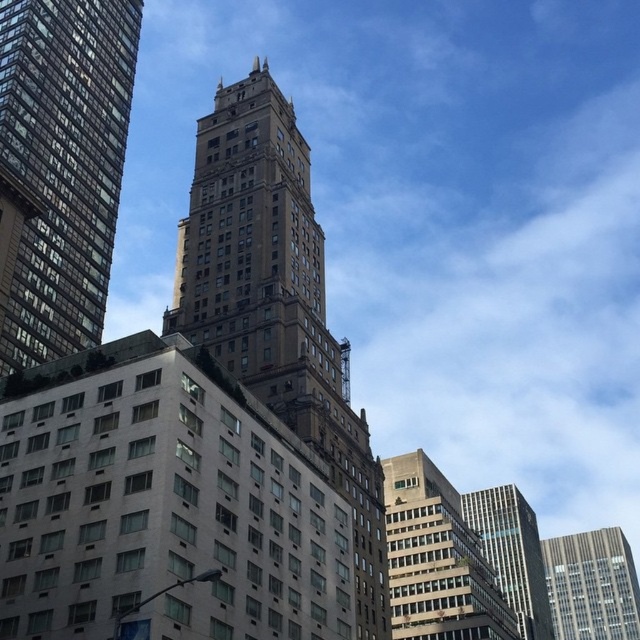
Question: Which object is farther from the camera taking this photo?

Choices:
 (A) glassy reflective skyscraper at center
 (B) gray concrete building at center
 (C) gray concrete skyscraper at center
 (D) brown stone tower at upper left

Answer: (C)

Question: Can you confirm if brown stone tower at center is smaller than glassy reflective skyscraper at center?

Choices:
 (A) yes
 (B) no

Answer: (A)

Question: Estimate the real-world distances between objects in this image. Which object is farther from the gray concrete building at center?

Choices:
 (A) brown stone tower at upper left
 (B) brown stone tower at center

Answer: (A)

Question: Is brown stone tower at center to the left of brown stone tower at upper left from the viewer's perspective?

Choices:
 (A) yes
 (B) no

Answer: (B)

Question: Is gray concrete skyscraper at center smaller than glassy reflective skyscraper at center?

Choices:
 (A) no
 (B) yes

Answer: (B)

Question: Which point is closer to the camera?

Choices:
 (A) gray concrete skyscraper at center
 (B) brown stone tower at center
 (C) glassy reflective skyscraper at center

Answer: (B)